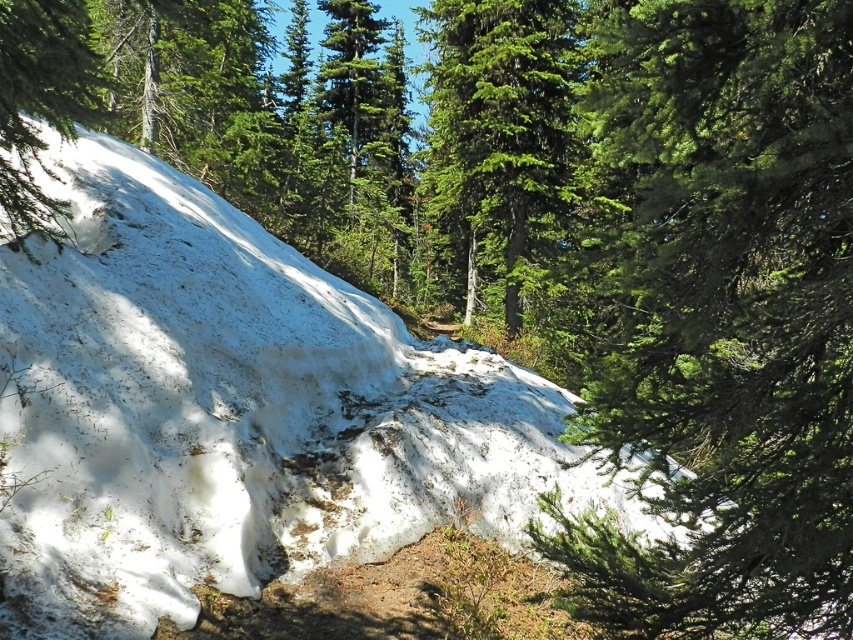
Can you confirm if green glossy tree at center is positioned to the left of green matte tree at upper left?

No, green glossy tree at center is not to the left of green matte tree at upper left.

Between point (538, 93) and point (7, 28), which one is positioned behind?

Positioned behind is point (538, 93).

The image size is (853, 640). Find the location of `green glossy tree at center`. green glossy tree at center is located at coordinates (500, 125).

Identify the location of green textured pine tree at upper right. The image size is (853, 640). (724, 317).

Consider the image. Is green textured pine tree at upper right smaller than green glossy tree at center?

Indeed, green textured pine tree at upper right has a smaller size compared to green glossy tree at center.

Between point (766, 403) and point (445, 188), which one is positioned in front?

Point (766, 403)

Locate an element on the screen. green textured pine tree at upper right is located at coordinates (724, 317).

Does green textured pine tree at upper right have a greater height compared to green matte tree at upper left?

In fact, green textured pine tree at upper right may be shorter than green matte tree at upper left.

Find the location of a particular element. green textured pine tree at upper right is located at coordinates (724, 317).